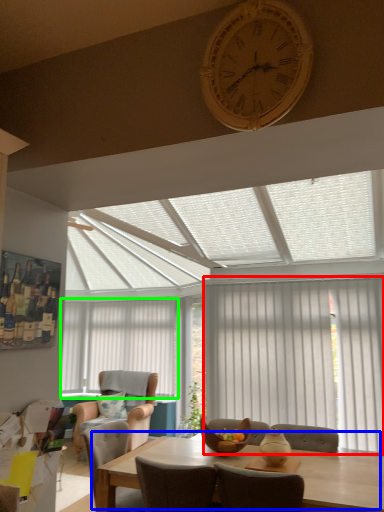
Question: Which is farther away from curtain (highlighted by a red box)? kitchen & dining room table (highlighted by a blue box) or blind (highlighted by a green box)?

Choices:
 (A) kitchen & dining room table
 (B) blind

Answer: (B)